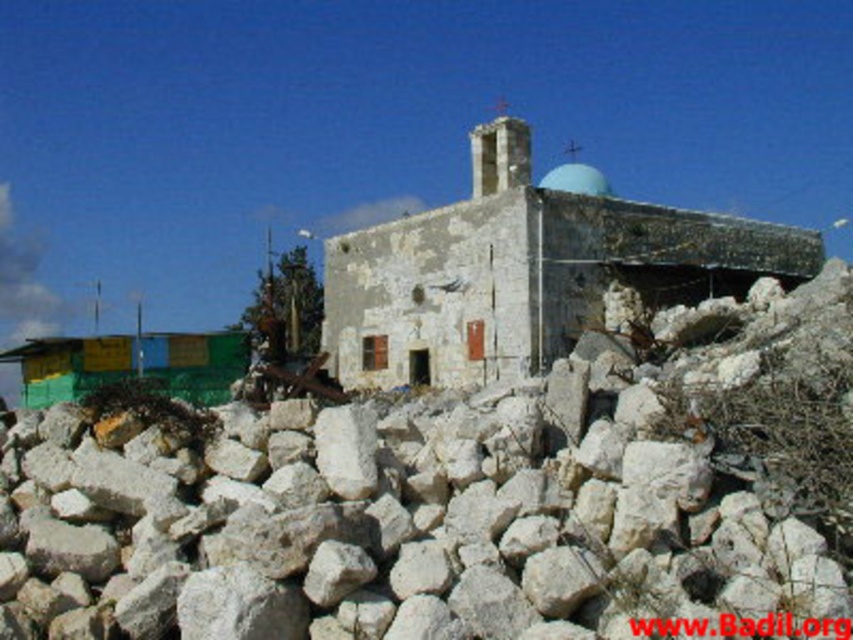
You are standing in a field and see the white rough rubble at center and the white stone church at center. Which object is positioned to the right?

The white stone church at center is positioned to the right of the white rough rubble at center.

You are a construction worker assessing the site. You see the white rough rubble at center and the white stone church at center. Which object takes up more area in the image?

The white stone church at center occupies more space than the white rough rubble at center, so the white stone church at center takes up more area in the image.